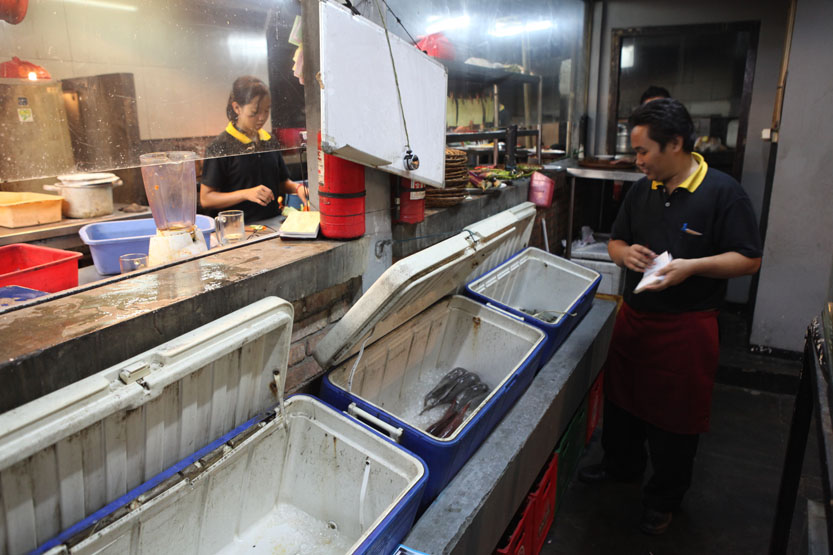
Where is `ceiling lights`? This screenshot has width=833, height=555. ceiling lights is located at coordinates (451, 21), (517, 28).